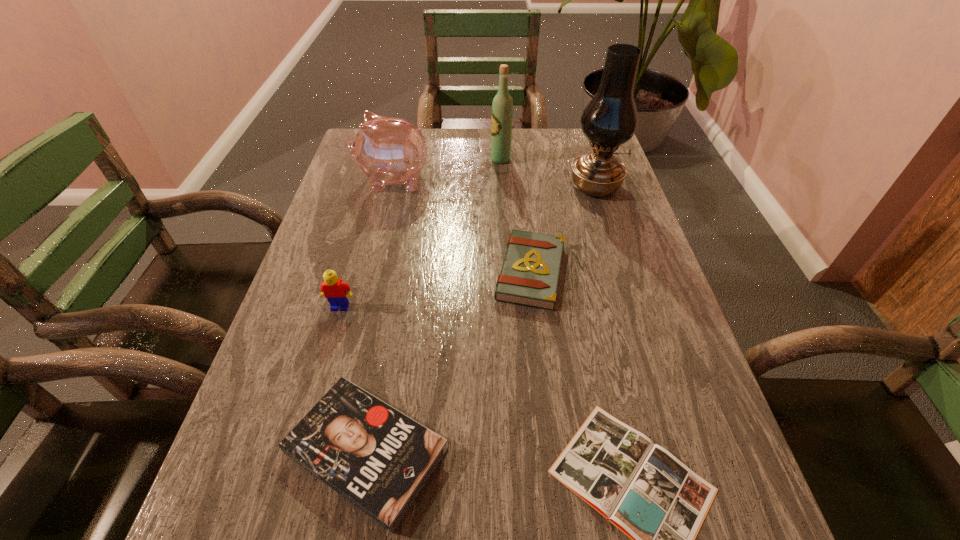
You are a GUI agent. You are given a task and a screenshot of the screen. Output one action in this format:
    pyautogui.click(x=<x>, y=<y>)
    Task: Click on the free space that satisfies the following two spatial constraints: 1. on the front-facing side of the fourth shortest object; 2. on the left side of the leftmost book
    Image resolution: width=960 pixels, height=540 pixels.
    Given the screenshot: What is the action you would take?
    pyautogui.click(x=299, y=451)

Locate an element on the screen. This screenshot has width=960, height=540. free region that satisfies the following two spatial constraints: 1. on the front-facing side of the wine bottle; 2. on the front-facing side of the Lego is located at coordinates (510, 307).